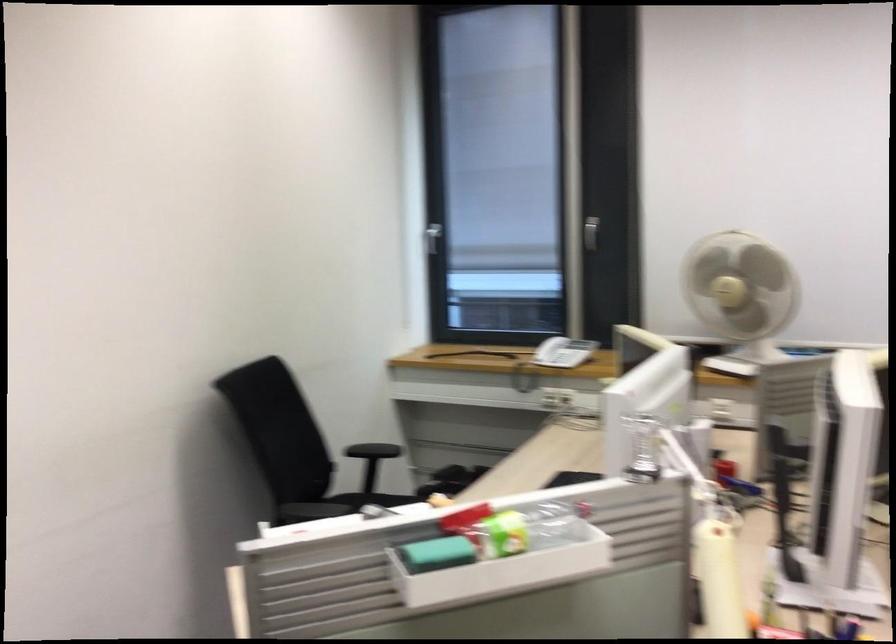
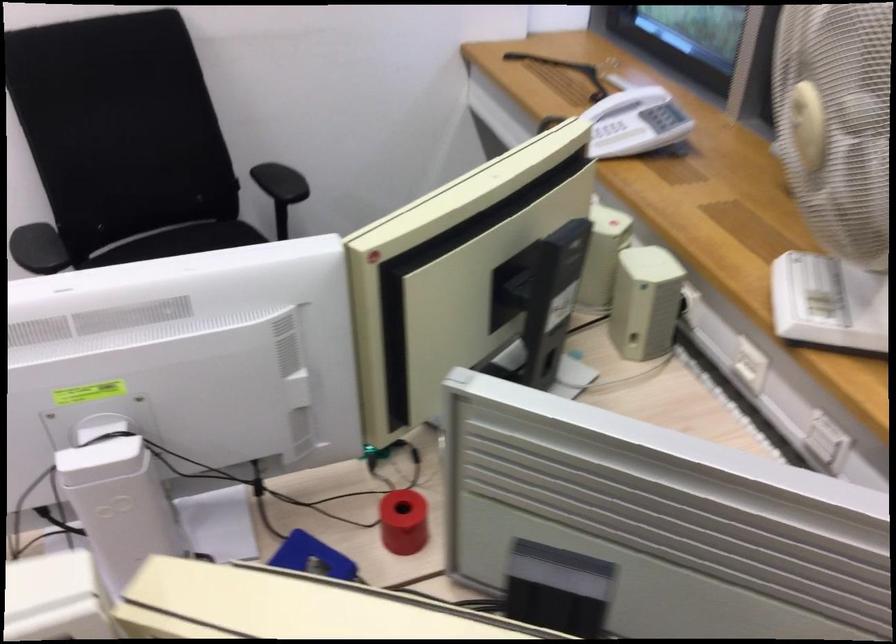
In the second image, find the point that corresponds to pixel 558 345 in the first image.

(617, 138)